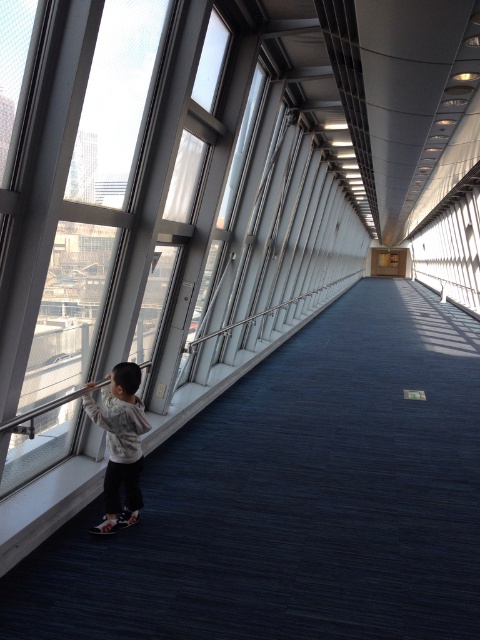
Is point (300, 326) behind point (130, 433)?

Yes, point (300, 326) is behind point (130, 433).

Which is above, smooth concrete ledge at left or light gray sweater at left?

smooth concrete ledge at left

Does point (164, 435) come farther from viewer compared to point (107, 432)?

That is True.

The width and height of the screenshot is (480, 640). Identify the location of smooth concrete ledge at left. (46, 506).